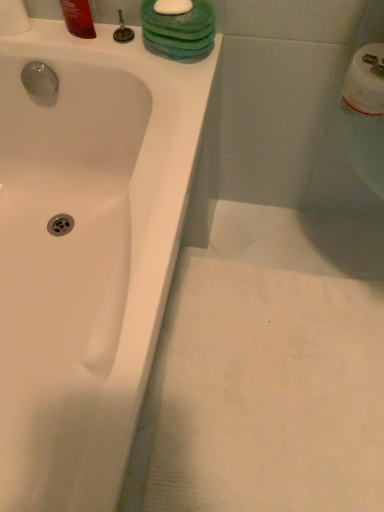
Find the location of a particular element. free space to the right of white paper towel at upper left is located at coordinates (76, 39).